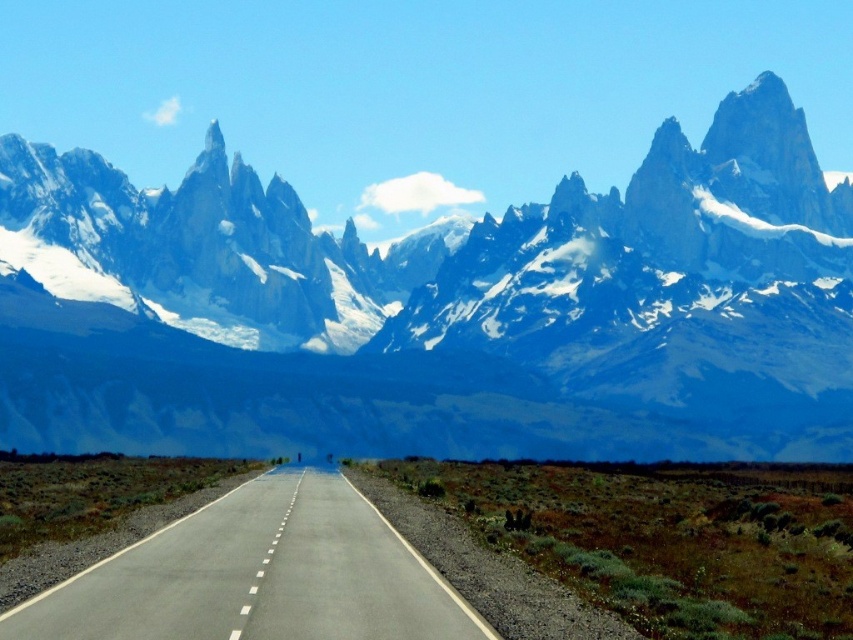
Question: Which of the following is the farthest from the observer?

Choices:
 (A) (80, 602)
 (B) (793, 346)

Answer: (B)

Question: Can you confirm if snowy granite mountain range at upper center is positioned to the left of asphalt road at center?

Choices:
 (A) yes
 (B) no

Answer: (A)

Question: Does snowy granite mountain range at upper center lie in front of asphalt road at center?

Choices:
 (A) no
 (B) yes

Answer: (A)

Question: Does snowy granite mountain range at upper center come in front of asphalt road at center?

Choices:
 (A) yes
 (B) no

Answer: (B)

Question: Which of the following is the farthest from the observer?

Choices:
 (A) (167, 593)
 (B) (560, 433)

Answer: (B)

Question: Which point is closer to the camera?

Choices:
 (A) asphalt road at center
 (B) snowy granite mountain range at upper center

Answer: (A)